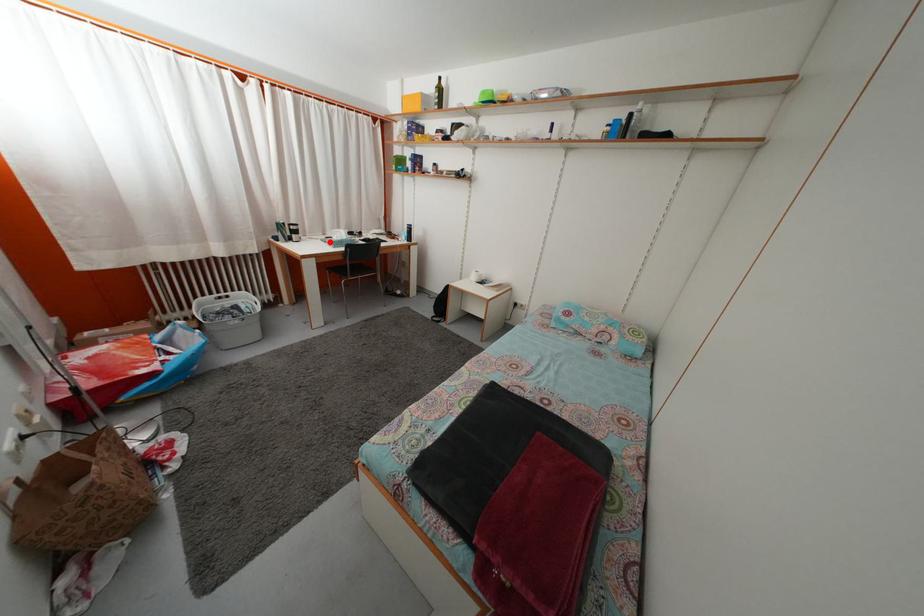
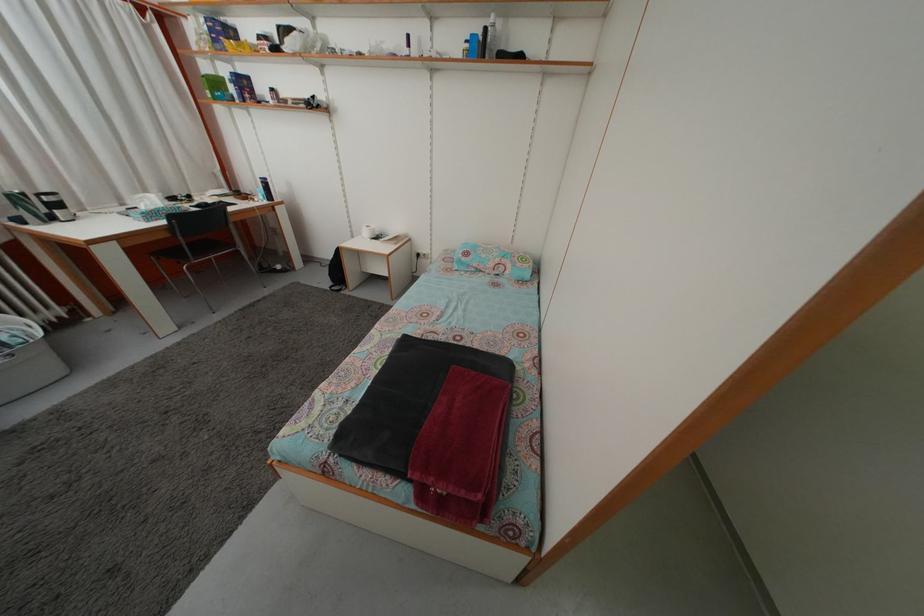
The point at the highlighted location is marked in the first image. Where is the corresponding point in the second image?

(128, 213)